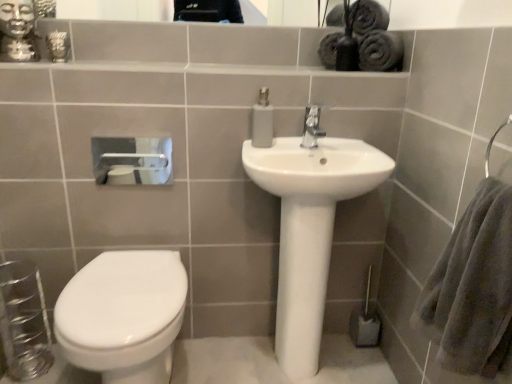
The width and height of the screenshot is (512, 384). I want to click on vacant space underneath glossy ceramic mirror at upper center (from a real-world perspective), so click(197, 55).